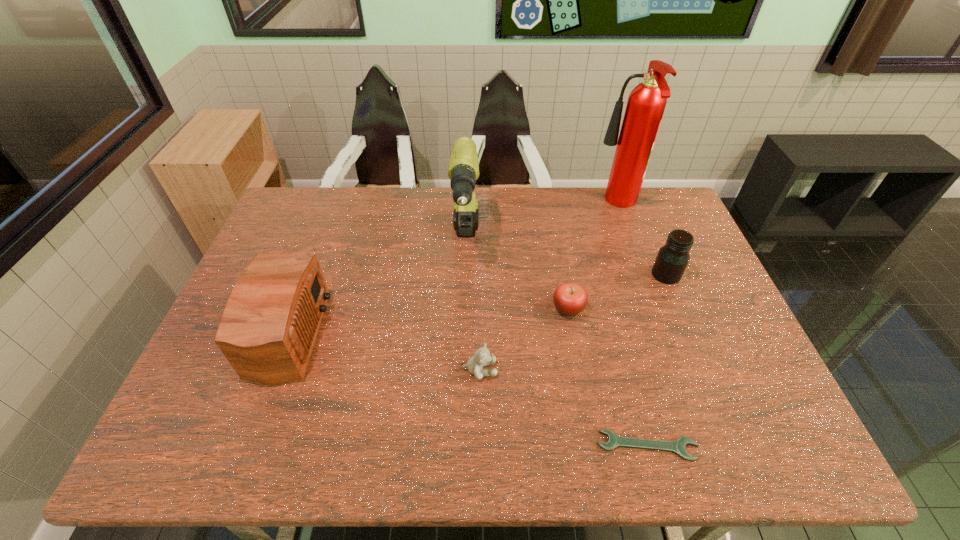
Find the location of `vacant space that's between the wrench and the jar`. vacant space that's between the wrench and the jar is located at coordinates (657, 360).

Where is `the second closest object to the apple`? the second closest object to the apple is located at coordinates (463, 171).

I want to click on object that can be found as the fourth closest to the sixth shortest object, so click(x=646, y=103).

Where is `vacant region that satisfies the following two spatial constraints: 1. on the handle side of the drill; 2. on the front-facing side of the radio receiver`? vacant region that satisfies the following two spatial constraints: 1. on the handle side of the drill; 2. on the front-facing side of the radio receiver is located at coordinates 463,334.

Locate an element on the screen. free space in the image that satisfies the following two spatial constraints: 1. on the handle side of the second tallest object; 2. on the left side of the jar is located at coordinates (465, 274).

The width and height of the screenshot is (960, 540). Find the location of `vacant space that satisfies the following two spatial constraints: 1. on the front-facing side of the leftmost object; 2. on the back side of the wrench`. vacant space that satisfies the following two spatial constraints: 1. on the front-facing side of the leftmost object; 2. on the back side of the wrench is located at coordinates (234, 446).

The image size is (960, 540). Identify the location of vacant area that satisfies the following two spatial constraints: 1. on the back side of the wrench; 2. on the front-facing side of the fifth shortest object. (617, 334).

I want to click on free spot that satisfies the following two spatial constraints: 1. on the face of the teddy bear; 2. on the left side of the shortest object, so click(x=480, y=446).

Find the location of a particular element. free space that satisfies the following two spatial constraints: 1. at the nozzle of the tallest object; 2. on the right side of the fourth tallest object is located at coordinates (x=641, y=274).

This screenshot has width=960, height=540. I want to click on free spot that satisfies the following two spatial constraints: 1. at the nozzle of the tallest object; 2. on the back side of the fourth shortest object, so click(x=641, y=274).